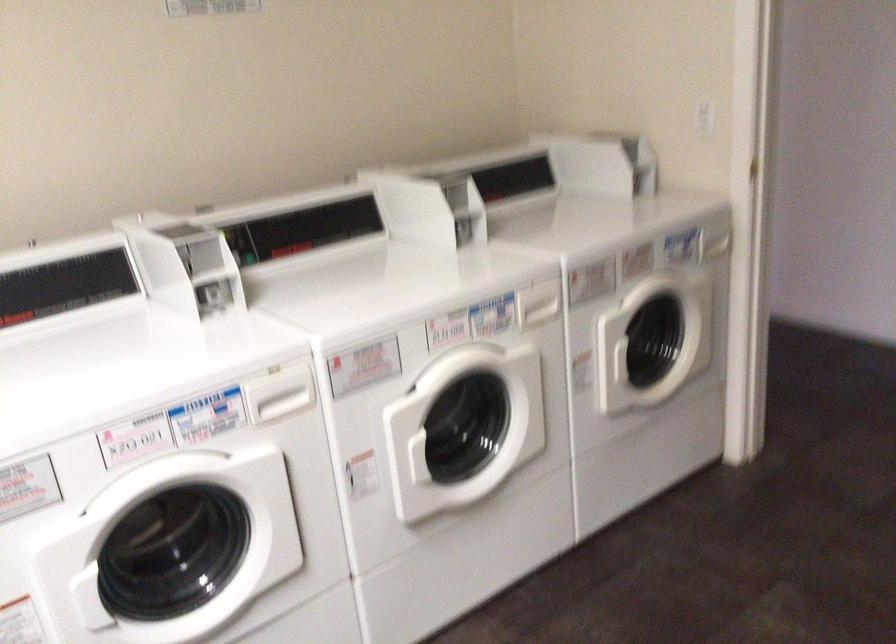
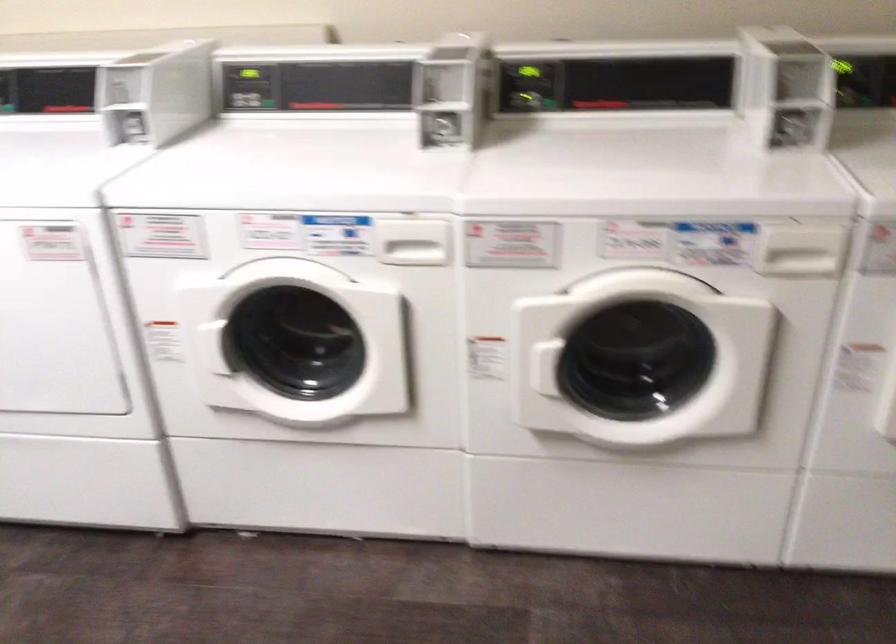
Question: I am providing you with two images of the same scene from different viewpoints. Please identify which objects are invisible in image2.

Choices:
 (A) white dispenser handle
 (B) black control button
 (C) white door handle
 (D) none of these

Answer: (D)